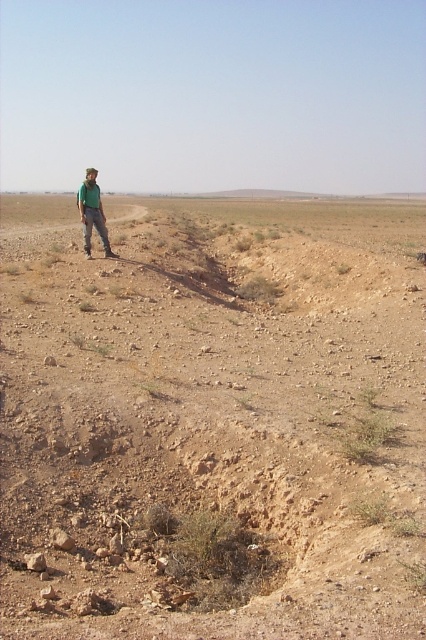
Is dusty brown dirt field at center further to the viewer compared to green matte shirt at left?

That is False.

Between dusty brown dirt field at center and green matte shirt at left, which one has more height?

dusty brown dirt field at center

Identify the location of dusty brown dirt field at center. coord(213,420).